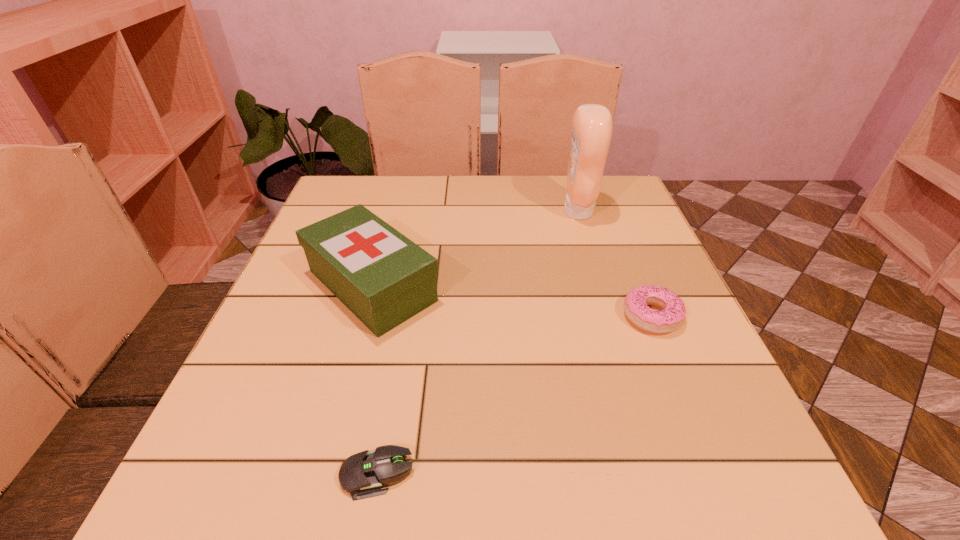
The image size is (960, 540). I want to click on free space that is in between the computer mouse and the second tallest object, so click(x=374, y=380).

You are a GUI agent. You are given a task and a screenshot of the screen. Output one action in this format:
    pyautogui.click(x=<x>, y=<y>)
    Task: Click on the blank region between the nearest object and the third shortest object
    This screenshot has width=960, height=540.
    Given the screenshot: What is the action you would take?
    pyautogui.click(x=374, y=380)

Identify the location of vacant area between the farthest object and the third shortest object. (475, 248).

The image size is (960, 540). I want to click on free point between the tallest object and the third shortest object, so click(475, 248).

The width and height of the screenshot is (960, 540). Find the location of `vacant region between the third shortest object and the computer mouse`. vacant region between the third shortest object and the computer mouse is located at coordinates (374, 380).

Choose which object is the third nearest neighbor to the nearest object. Please provide its 2D coordinates. Your answer should be formatted as a tuple, i.e. [(x, y)], where the tuple contains the x and y coordinates of a point satisfying the conditions above.

[(592, 126)]

Locate an element on the screen. object that is the second closest to the condiment is located at coordinates (381, 276).

The height and width of the screenshot is (540, 960). I want to click on vacant region that satisfies the following two spatial constraints: 1. on the back side of the second shortest object; 2. on the label of the condiment, so click(610, 211).

Image resolution: width=960 pixels, height=540 pixels. I want to click on free location that satisfies the following two spatial constraints: 1. on the front side of the shortest object; 2. on the right side of the third shortest object, so click(x=321, y=474).

Where is `vacant region that satisfies the following two spatial constraints: 1. on the front side of the first-aid kit; 2. on the left side of the doughnut`? vacant region that satisfies the following two spatial constraints: 1. on the front side of the first-aid kit; 2. on the left side of the doughnut is located at coordinates (364, 316).